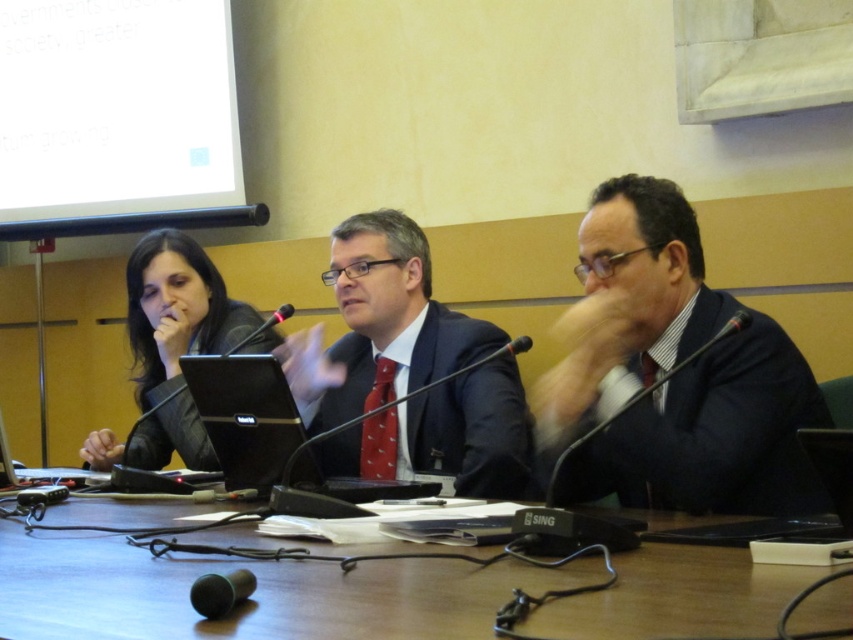
Question: Which object is the closest to the wooden table at center?

Choices:
 (A) silver metallic laptop at center
 (B) black fabric jacket at left
 (C) black plastic laptop at center
 (D) matte black suit at center

Answer: (C)

Question: Is navy blue suit at center further to camera compared to black plastic laptop at center?

Choices:
 (A) no
 (B) yes

Answer: (A)

Question: Which of the following is the farthest from the observer?

Choices:
 (A) matte black suit at center
 (B) navy blue suit at center
 (C) wooden table at center

Answer: (A)

Question: Which object appears farthest from the camera in this image?

Choices:
 (A) silver metallic laptop at center
 (B) matte black suit at center

Answer: (A)

Question: In this image, where is matte black suit at center located relative to black fabric jacket at left?

Choices:
 (A) left
 (B) right

Answer: (B)

Question: Does wooden table at center appear on the right side of navy blue suit at center?

Choices:
 (A) no
 (B) yes

Answer: (A)